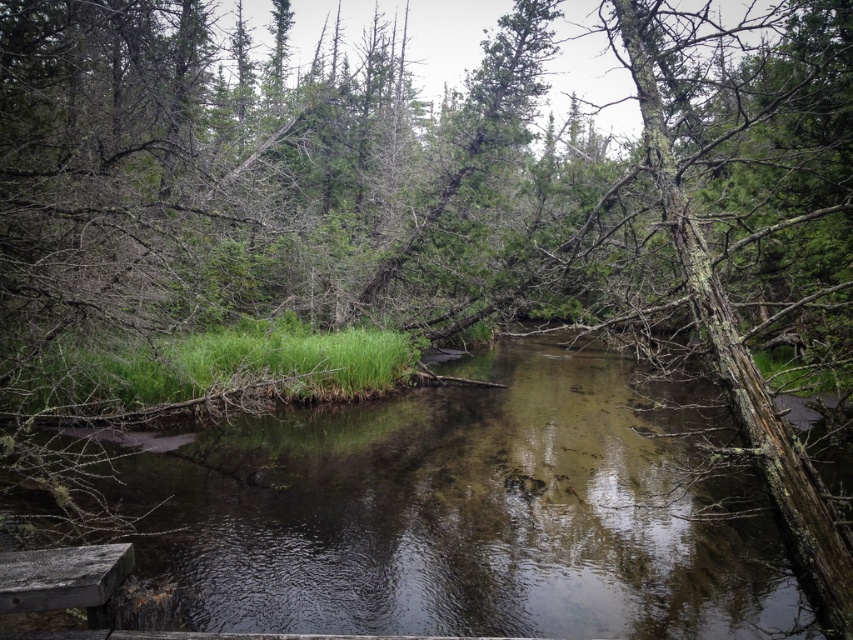
Based on the photo, based on the scene description, where is the green grassy river at center located in the image?

The green grassy river at center is located at point (465, 513).

You are standing on the rusty wooden plank at lower left and want to cross to the green grassy river at center. Is the river directly below you?

Yes, the green grassy river at center is directly below the rusty wooden plank at lower left, so you can step down to reach it.

You are a hiker trying to cross the stream. You see the green grassy river at center and the rusty wooden plank at lower left. Which one is wider?

The green grassy river at center might be wider than rusty wooden plank at lower left.